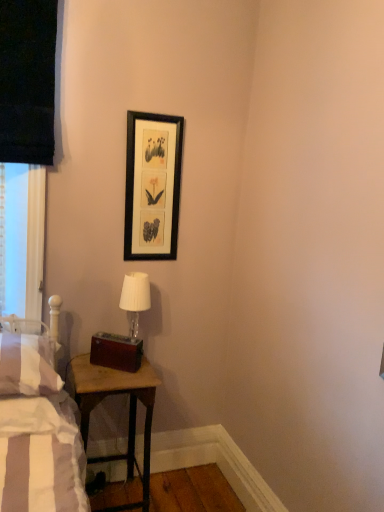
Locate an element on the screen. black matte picture frame at upper center is located at coordinates (152, 185).

Locate an element on the screen. This screenshot has width=384, height=512. wooden table at lower left is located at coordinates (129, 411).

Is black matte picture frame at upper center placed right next to white fabric lampshade at center?

They are not placed beside each other.

From a real-world perspective, is black matte picture frame at upper center positioned under white fabric lampshade at center based on gravity?

No, from a real-world perspective, black matte picture frame at upper center is not beneath white fabric lampshade at center.

At what (x,y) coordinates should I click in order to perform the action: click on picture frame above the white fabric lampshade at center (from a real-world perspective). Please return your answer as a coordinate pair (x, y). The width and height of the screenshot is (384, 512). Looking at the image, I should click on (152, 185).

Which is farther, (164,158) or (137,290)?

Point (164,158)

How different are the orientations of black matte picture frame at upper center and white striped pillow at left in degrees?

black matte picture frame at upper center and white striped pillow at left are facing 1.59 degrees away from each other.

Is black matte picture frame at upper center at the left side of white striped pillow at left?

In fact, black matte picture frame at upper center is to the right of white striped pillow at left.

Locate an element on the screen. The image size is (384, 512). pillow that appears below the black matte picture frame at upper center (from the image's perspective) is located at coordinates (28, 365).

From the image's perspective, which one is positioned lower, black matte picture frame at upper center or white striped pillow at left?

white striped pillow at left, from the image's perspective.

From the image's perspective, is white fabric lampshade at center located above or below black matte picture frame at upper center?

Clearly, from the image's perspective, white fabric lampshade at center is below black matte picture frame at upper center.

How many degrees apart are the facing directions of white fabric lampshade at center and black matte picture frame at upper center?

2.64 degrees.

Is white fabric lampshade at center far from black matte picture frame at upper center?

They are positioned close to each other.

Does white fabric lampshade at center appear on the right side of black matte picture frame at upper center?

In fact, white fabric lampshade at center is to the left of black matte picture frame at upper center.

From the image's perspective, is black matte picture frame at upper center above or below wooden table at lower left?

black matte picture frame at upper center is above wooden table at lower left.

Considering the relative positions of black matte picture frame at upper center and wooden table at lower left in the image provided, is black matte picture frame at upper center to the right of wooden table at lower left from the viewer's perspective?

Yes.

Could you tell me if black matte picture frame at upper center is turned towards wooden table at lower left?

No, black matte picture frame at upper center does not turn towards wooden table at lower left.

From a real-world perspective, is black matte picture frame at upper center above or below wooden table at lower left?

black matte picture frame at upper center is above wooden table at lower left.

From the image's perspective, is white striped pillow at left located beneath black matte picture frame at upper center?

Indeed, from the image's perspective, white striped pillow at left is shown beneath black matte picture frame at upper center.

Is there a large distance between white striped pillow at left and black matte picture frame at upper center?

white striped pillow at left is near black matte picture frame at upper center, not far away.

From a real-world perspective, between white striped pillow at left and black matte picture frame at upper center, who is vertically higher?

In real-world perspective, black matte picture frame at upper center is above.

Can you confirm if white striped pillow at left is smaller than black matte picture frame at upper center?

Actually, white striped pillow at left might be larger than black matte picture frame at upper center.

Is white fabric lampshade at center taller than white striped pillow at left?

Indeed, white fabric lampshade at center has a greater height compared to white striped pillow at left.

Is point (128, 303) closer or farther from the camera than point (59, 378)?

Point (128, 303) is positioned farther from the camera compared to point (59, 378).

Looking at their sizes, would you say white fabric lampshade at center is wider or thinner than white striped pillow at left?

Considering their sizes, white fabric lampshade at center looks slimmer than white striped pillow at left.

From a real-world perspective, is white striped pillow at left below wooden table at lower left?

Actually, white striped pillow at left is physically above wooden table at lower left in the real world.

Is white striped pillow at left taller or shorter than wooden table at lower left?

white striped pillow at left is shorter than wooden table at lower left.

Considering the positions of objects white striped pillow at left and wooden table at lower left in the image provided, who is more to the right, white striped pillow at left or wooden table at lower left?

Positioned to the right is wooden table at lower left.

Which is closer, (x=21, y=372) or (x=141, y=384)?

Point (x=21, y=372) is positioned closer to the camera compared to point (x=141, y=384).

Locate an element on the screen. table lamp located in front of the black matte picture frame at upper center is located at coordinates (135, 298).

Find the location of a particular element. pillow below the black matte picture frame at upper center (from the image's perspective) is located at coordinates (28, 365).

When comparing their distances from wooden table at lower left, does white striped pillow at left or white fabric lampshade at center seem further?

white fabric lampshade at center is further to wooden table at lower left.

Based on their spatial positions, is white fabric lampshade at center or black matte picture frame at upper center further from white striped pillow at left?

black matte picture frame at upper center.

Which object lies nearer to the anchor point white fabric lampshade at center, wooden table at lower left or white striped pillow at left?

wooden table at lower left lies closer to white fabric lampshade at center than the other object.

In the scene shown: Considering their positions, is wooden table at lower left positioned further to white fabric lampshade at center than black matte picture frame at upper center?

The object further to white fabric lampshade at center is wooden table at lower left.

Based on their spatial positions, is black matte picture frame at upper center or wooden table at lower left further from white fabric lampshade at center?

wooden table at lower left is further to white fabric lampshade at center.

Which object lies further to the anchor point white striped pillow at left, wooden table at lower left or black matte picture frame at upper center?

Based on the image, black matte picture frame at upper center appears to be further to white striped pillow at left.

Which object lies nearer to the anchor point white striped pillow at left, wooden table at lower left or white fabric lampshade at center?

wooden table at lower left lies closer to white striped pillow at left than the other object.

From the image, which object appears to be nearer to black matte picture frame at upper center, white fabric lampshade at center or white striped pillow at left?

white fabric lampshade at center is positioned closer to the anchor black matte picture frame at upper center.

Where is `table lamp between black matte picture frame at upper center and wooden table at lower left from top to bottom`? table lamp between black matte picture frame at upper center and wooden table at lower left from top to bottom is located at coordinates (135, 298).

Where is `pillow between white fabric lampshade at center and wooden table at lower left from top to bottom`? pillow between white fabric lampshade at center and wooden table at lower left from top to bottom is located at coordinates (28, 365).

Image resolution: width=384 pixels, height=512 pixels. In order to click on table lamp between black matte picture frame at upper center and white striped pillow at left vertically in this screenshot , I will do `click(135, 298)`.

Find the location of a particular element. Image resolution: width=384 pixels, height=512 pixels. pillow between black matte picture frame at upper center and wooden table at lower left in the up-down direction is located at coordinates (28, 365).